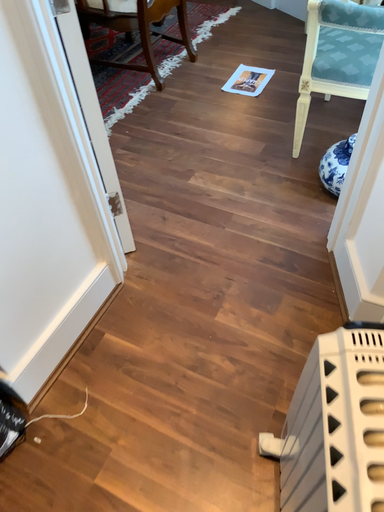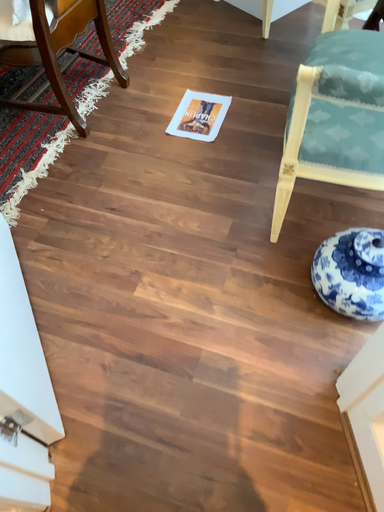
Question: Which way did the camera rotate in the video?

Choices:
 (A) rotated right
 (B) rotated left

Answer: (A)